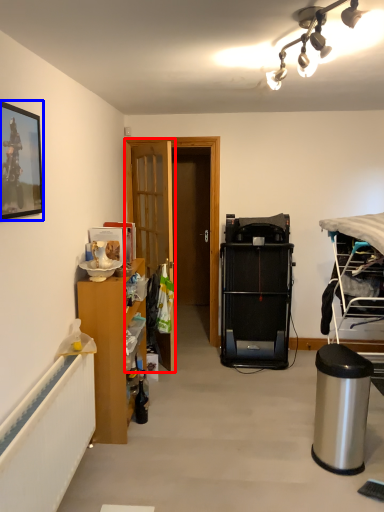
Question: Which of the following is the farthest to the observer, door (highlighted by a red box) or picture frame (highlighted by a blue box)?

Choices:
 (A) door
 (B) picture frame

Answer: (A)